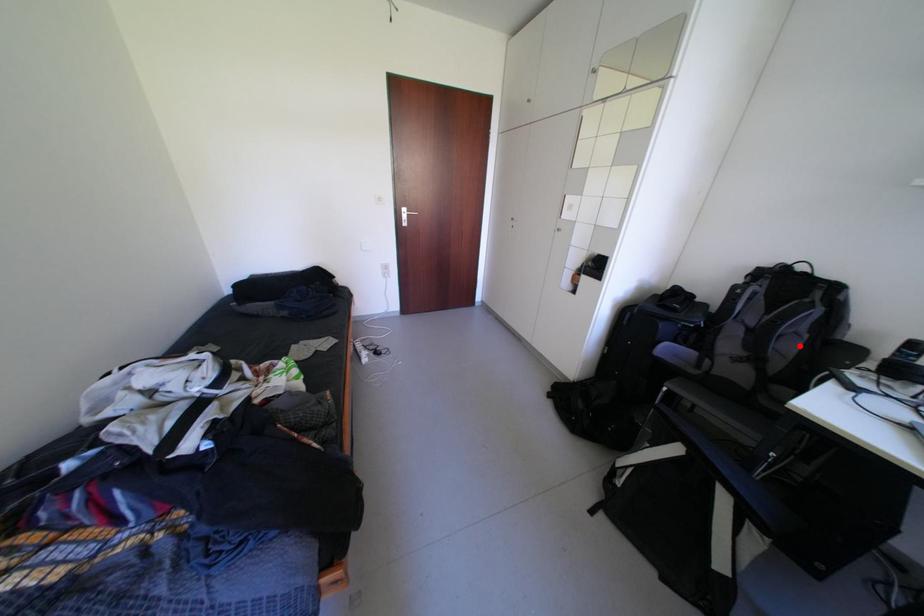
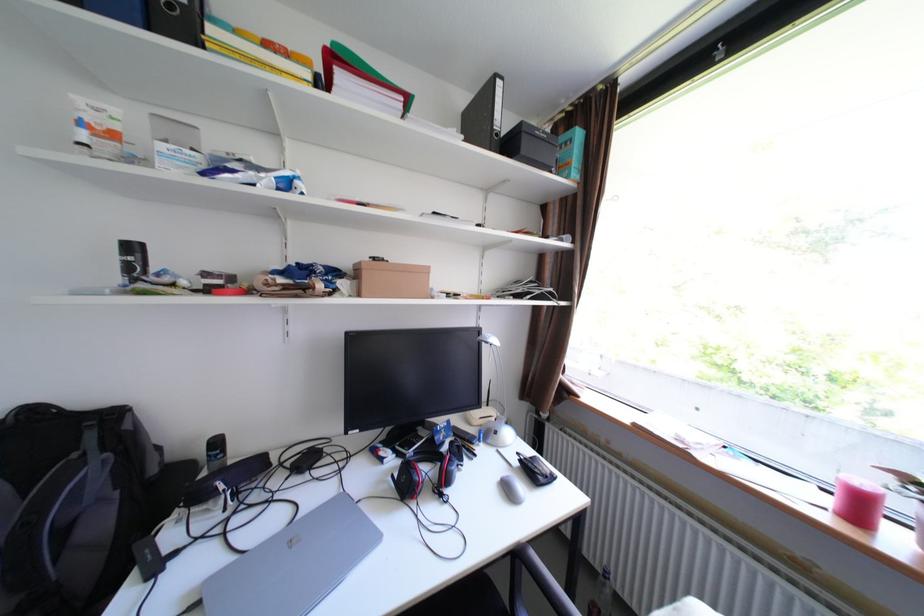
Question: I am providing you with two images of the same scene from different viewpoints. In image1, a red point is highlighted. Considering the same 3D point in image2, which of the following is correct?

Choices:
 (A) It is closer
 (B) It is farther

Answer: (A)